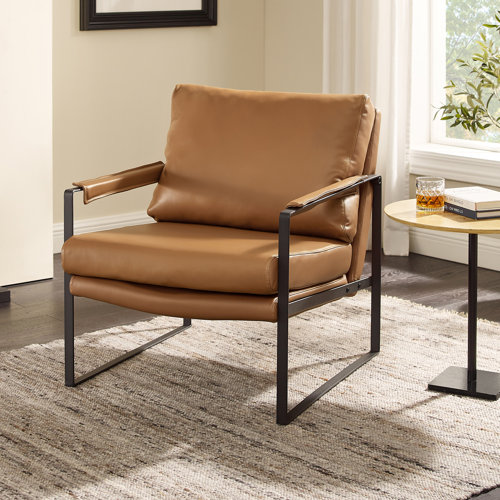
Identify the location of glass with brown liquid. (426, 192).